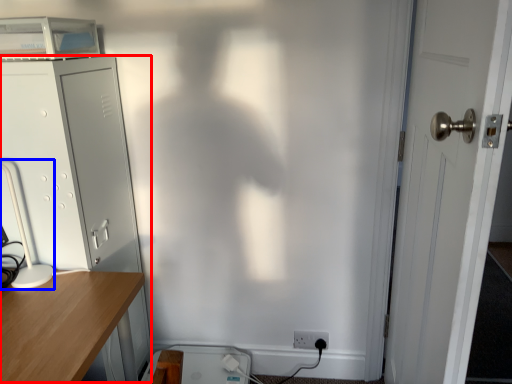
Question: Which object appears farthest to the camera in this image, file cabinet (highlighted by a red box) or table lamp (highlighted by a blue box)?

Choices:
 (A) file cabinet
 (B) table lamp

Answer: (A)